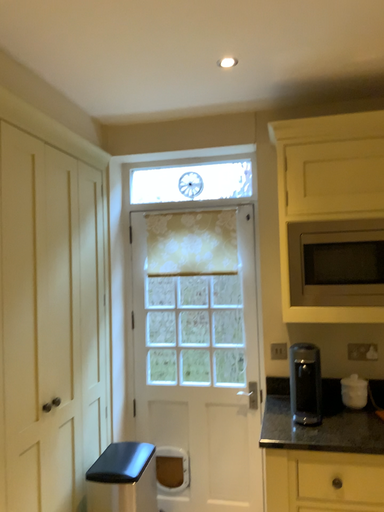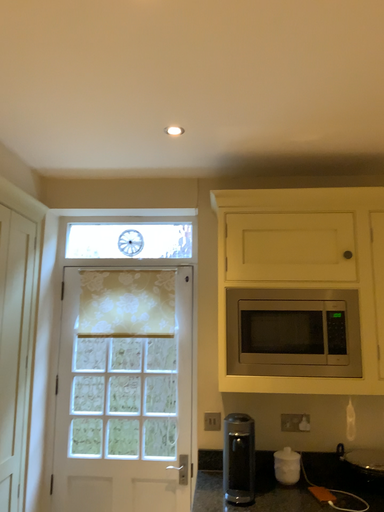
Question: Which way did the camera rotate in the video?

Choices:
 (A) rotated right
 (B) rotated left

Answer: (A)